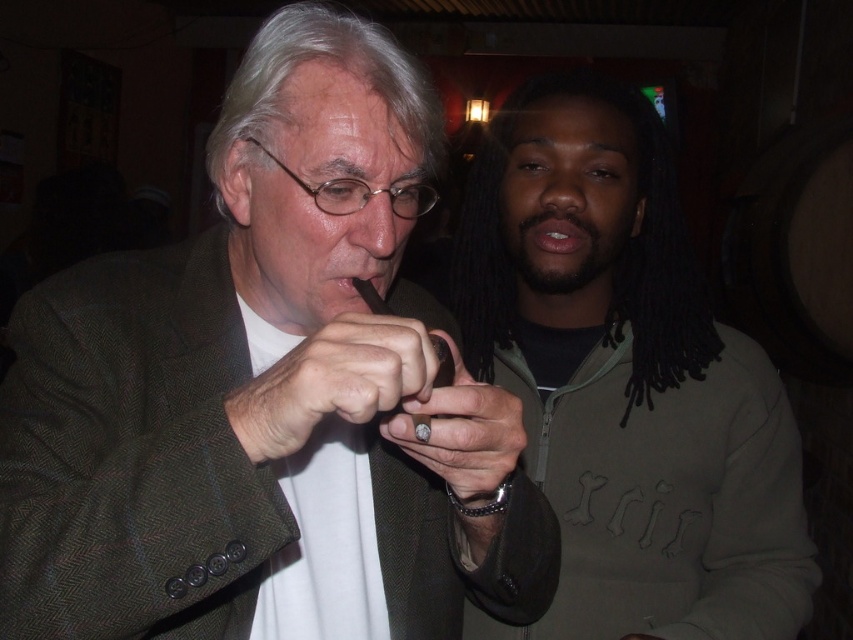
Question: Is silver metallic ring at center further to camera compared to pink glossy lips at center?

Choices:
 (A) yes
 (B) no

Answer: (B)

Question: Which object is farther from the camera taking this photo?

Choices:
 (A) black matte mouth at center
 (B) pink glossy lips at center

Answer: (B)

Question: Which point is closer to the camera taking this photo?

Choices:
 (A) (341, 401)
 (B) (753, 422)
 (C) (474, 397)
 (D) (556, 234)

Answer: (A)

Question: Considering the relative positions of silver metallic ring at center and pink glossy lips at center in the image provided, where is silver metallic ring at center located with respect to pink glossy lips at center?

Choices:
 (A) above
 (B) below

Answer: (B)

Question: Is green textured blazer at center closer to the viewer compared to silver metallic ring at center?

Choices:
 (A) yes
 (B) no

Answer: (A)

Question: Which point is farther to the camera?

Choices:
 (A) (386, 406)
 (B) (485, 388)
 (C) (332, 323)
 (D) (354, 282)

Answer: (D)